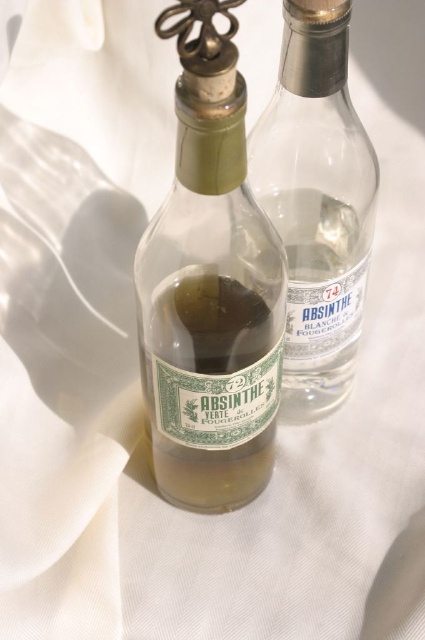
Does green glass absinthe bottle at center have a lesser width compared to green glass absinthe at center?

Incorrect, green glass absinthe bottle at center's width is not less than green glass absinthe at center's.

Does point (158, 273) lie behind point (269, 406)?

That is False.

The image size is (425, 640). I want to click on green glass absinthe bottle at center, so click(209, 289).

In the scene shown: Is green glass absinthe bottle at center closer to the viewer compared to transparent glass absinthe bottle at center?

Yes, green glass absinthe bottle at center is in front of transparent glass absinthe bottle at center.

Who is shorter, green glass absinthe bottle at center or transparent glass absinthe bottle at center?

transparent glass absinthe bottle at center is shorter.

Which is behind, point (198, 74) or point (343, 356)?

The point (343, 356) is more distant.

Where is `green glass absinthe bottle at center`? This screenshot has height=640, width=425. green glass absinthe bottle at center is located at coordinates (209, 289).

Which is more to the left, transparent glass absinthe bottle at center or green glass absinthe at center?

green glass absinthe at center is more to the left.

Is the position of transparent glass absinthe bottle at center less distant than that of green glass absinthe at center?

Yes, it is in front of green glass absinthe at center.

Does point (311, 282) come in front of point (170, 336)?

No, (311, 282) is behind (170, 336).

At what (x,y) coordinates should I click in order to perform the action: click on transparent glass absinthe bottle at center. Please return your answer as a coordinate pair (x, y). Looking at the image, I should click on (317, 202).